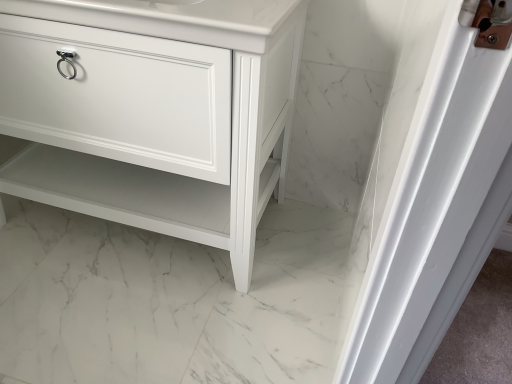
This screenshot has width=512, height=384. I want to click on vacant space in front of white painted wood cabinet at center, so click(x=122, y=317).